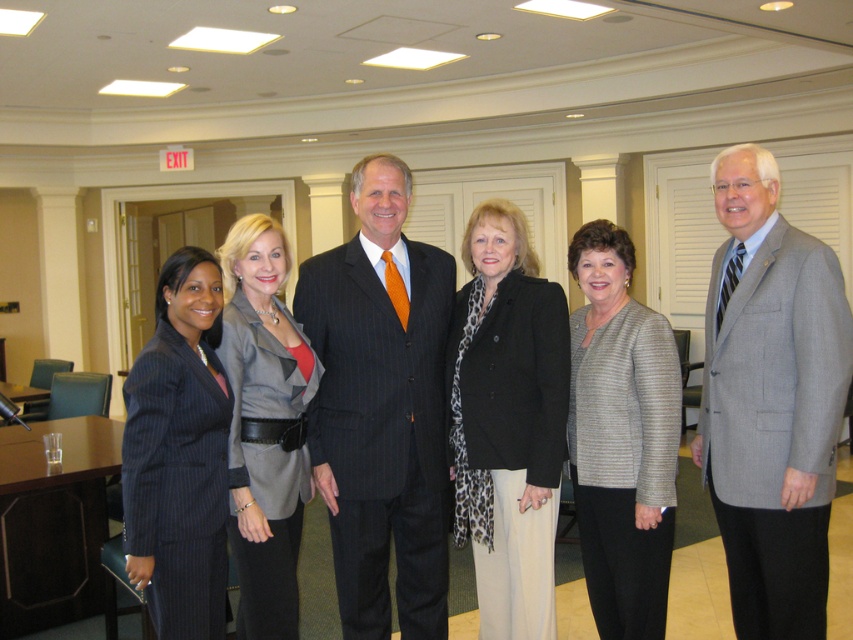
Based on the scene description and the coordinates provided, which object is located at the point with coordinates (381, 408)?

The point at coordinates (381, 408) corresponds to the pinstripe suit at center.

You are organizing a team photo and need to arrange the two individuals in the image based on their clothing sizes. Which person should stand where to ensure proper alignment? Please consider the dark blue pinstripe suit at left and the gray textured blazer at center.

The dark blue pinstripe suit at left should be placed on the left side and the gray textured blazer at center on the right since the dark blue pinstripe suit at left is smaller in size compared to the gray textured blazer at center, ensuring proper alignment based on size.

You are a photographer positioned at the far left of the group. You need to take a photo of the gray pinstripe suit at center. Can you capture the entire group in the frame without moving your position?

The gray pinstripe suit at center is 2.58 meters away from you. Since you are positioned at the far left, the distance might be too far to capture the entire group in one frame without moving. Consider moving closer or using a wider lens.